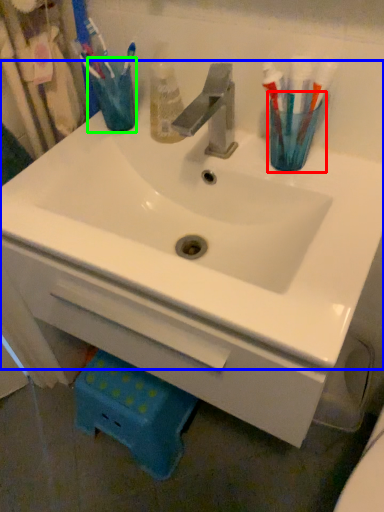
Question: Based on their relative distances, which object is farther from turquoise (highlighted by a red box)? Choose from sink (highlighted by a blue box) and turquoise (highlighted by a green box).

Choices:
 (A) sink
 (B) turquoise

Answer: (B)